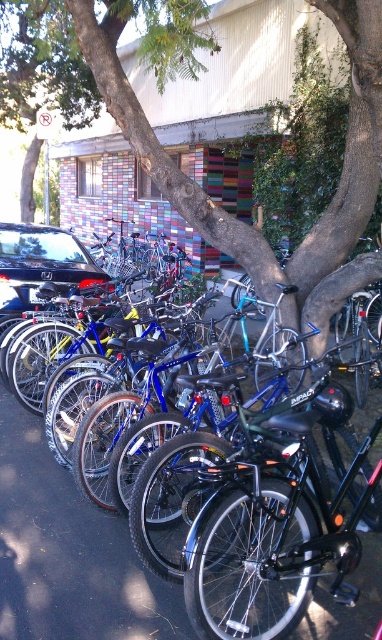
Question: Considering the relative positions of smooth bark tree at center and black rubber pavement at center in the image provided, where is smooth bark tree at center located with respect to black rubber pavement at center?

Choices:
 (A) above
 (B) below

Answer: (A)

Question: Is smooth bark tree at center behind black rubber pavement at center?

Choices:
 (A) yes
 (B) no

Answer: (A)

Question: Estimate the real-world distances between objects in this image. Which object is farther from the smooth bark tree at center?

Choices:
 (A) black rubber pavement at center
 (B) glossy black car at left

Answer: (A)

Question: Does black rubber pavement at center lie behind glossy black car at left?

Choices:
 (A) no
 (B) yes

Answer: (A)

Question: Which point appears closest to the camera in this image?

Choices:
 (A) pos(35,260)
 (B) pos(98,572)
 (C) pos(106,97)

Answer: (B)

Question: Which is farther from the black rubber pavement at center?

Choices:
 (A) glossy black car at left
 (B) smooth bark tree at center

Answer: (B)